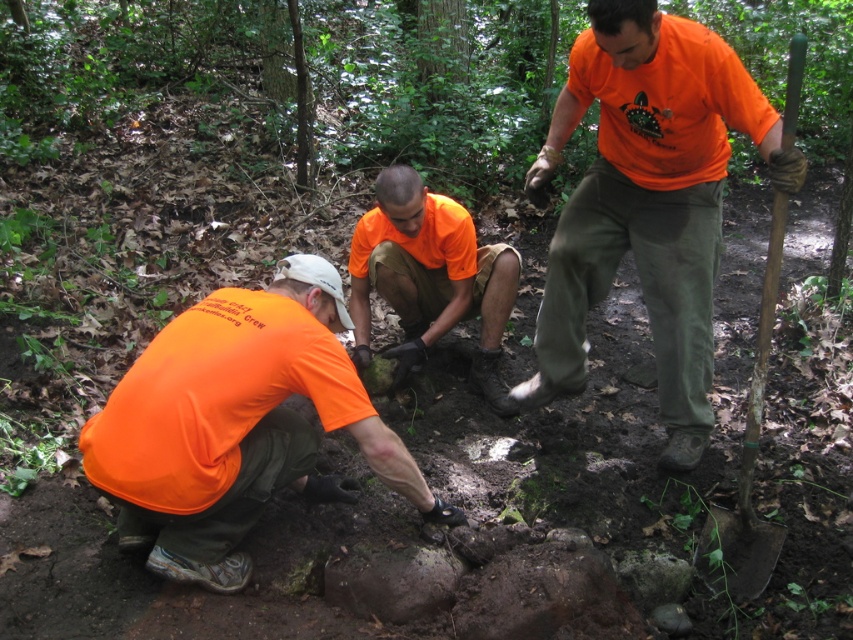
Based on the photo, does matte orange shirt at center come behind orange matte shirt at center?

No, matte orange shirt at center is closer to the viewer.

Is matte orange shirt at center to the left of orange matte shirt at center from the viewer's perspective?

In fact, matte orange shirt at center is to the right of orange matte shirt at center.

Which is in front, point (676, 401) or point (372, 248)?

Point (676, 401)

This screenshot has height=640, width=853. Find the location of `matte orange shirt at center`. matte orange shirt at center is located at coordinates (647, 202).

Can you confirm if matte orange shirt at lower left is smaller than wooden handle shovel at right?

Yes, matte orange shirt at lower left is smaller than wooden handle shovel at right.

Which is more to the left, matte orange shirt at lower left or wooden handle shovel at right?

Positioned to the left is matte orange shirt at lower left.

The image size is (853, 640). I want to click on matte orange shirt at lower left, so click(x=236, y=424).

Is matte orange shirt at center shorter than matte orange shirt at lower left?

No, matte orange shirt at center is not shorter than matte orange shirt at lower left.

Between matte orange shirt at center and matte orange shirt at lower left, which one appears on the left side from the viewer's perspective?

From the viewer's perspective, matte orange shirt at lower left appears more on the left side.

Is point (618, 193) in front of point (345, 499)?

No, it is not.

Find the location of a particular element. Image resolution: width=853 pixels, height=640 pixels. matte orange shirt at center is located at coordinates (647, 202).